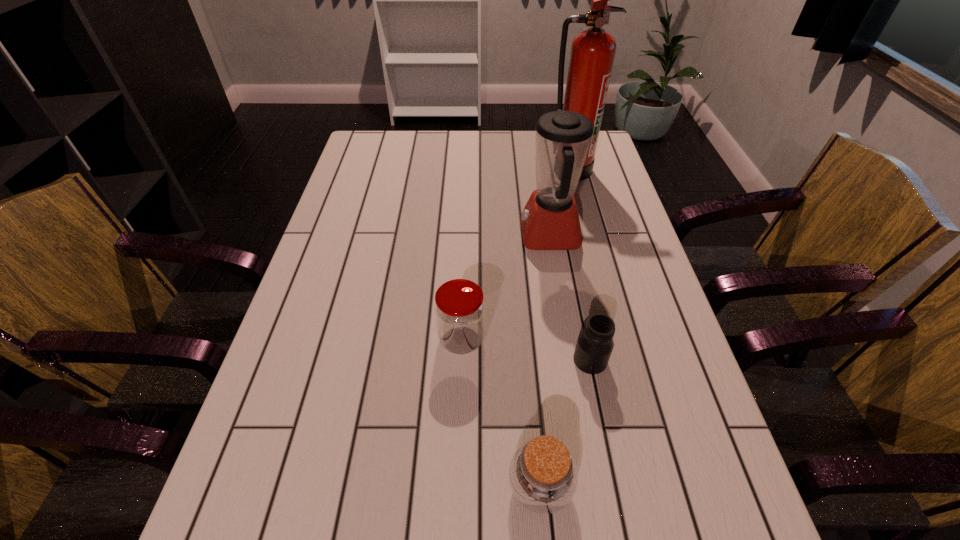
Find the location of a particular element. The width and height of the screenshot is (960, 540). blank region between the nearest jar and the leftmost jar is located at coordinates (500, 414).

Where is `vacant space in between the nearest jar and the rightmost jar`? vacant space in between the nearest jar and the rightmost jar is located at coordinates (565, 423).

Identify the location of unoccupied position between the rightmost jar and the second jar from left to right. The height and width of the screenshot is (540, 960). (565, 423).

You are a GUI agent. You are given a task and a screenshot of the screen. Output one action in this format:
    pyautogui.click(x=<x>, y=<y>)
    Task: Click on the vacant region between the fire extinguisher and the tallest jar
    
    Given the screenshot: What is the action you would take?
    pyautogui.click(x=516, y=255)

Choose which object is the second nearest neighbor to the leftmost jar. Please provide its 2D coordinates. Your answer should be formatted as a tuple, i.e. [(x, y)], where the tuple contains the x and y coordinates of a point satisfying the conditions above.

[(543, 476)]

Select which object appears as the fourth closest to the third shortest object. Please provide its 2D coordinates. Your answer should be formatted as a tuple, i.e. [(x, y)], where the tuple contains the x and y coordinates of a point satisfying the conditions above.

[(592, 55)]

The image size is (960, 540). Identify the location of jar that can be found as the closest to the leftmost object. (594, 346).

At what (x,y) coordinates should I click in order to perform the action: click on the second closest jar relative to the second farthest object. Please return your answer as a coordinate pair (x, y). The image size is (960, 540). Looking at the image, I should click on (594, 346).

In order to click on vacant area in the image that satisfies the following two spatial constraints: 1. on the front side of the second jar from right to left; 2. on the right side of the third shortest object in this screenshot , I will do `click(456, 487)`.

The width and height of the screenshot is (960, 540). In order to click on vacant space that satisfies the following two spatial constraints: 1. with the nozzle pointing from the back of the tallest object; 2. on the front of the blender near the controls in this screenshot , I will do `click(588, 235)`.